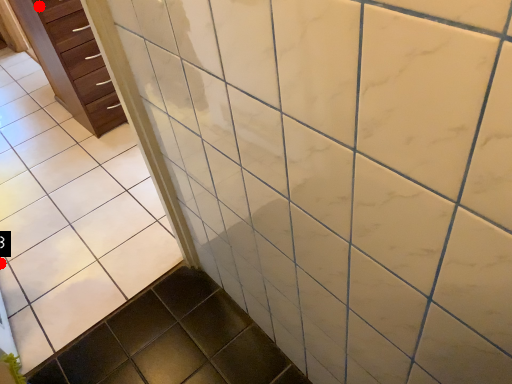
Question: Two points are circled on the image, labeled by A and B beside each circle. Which point is closer to the camera?

Choices:
 (A) A is closer
 (B) B is closer

Answer: (B)